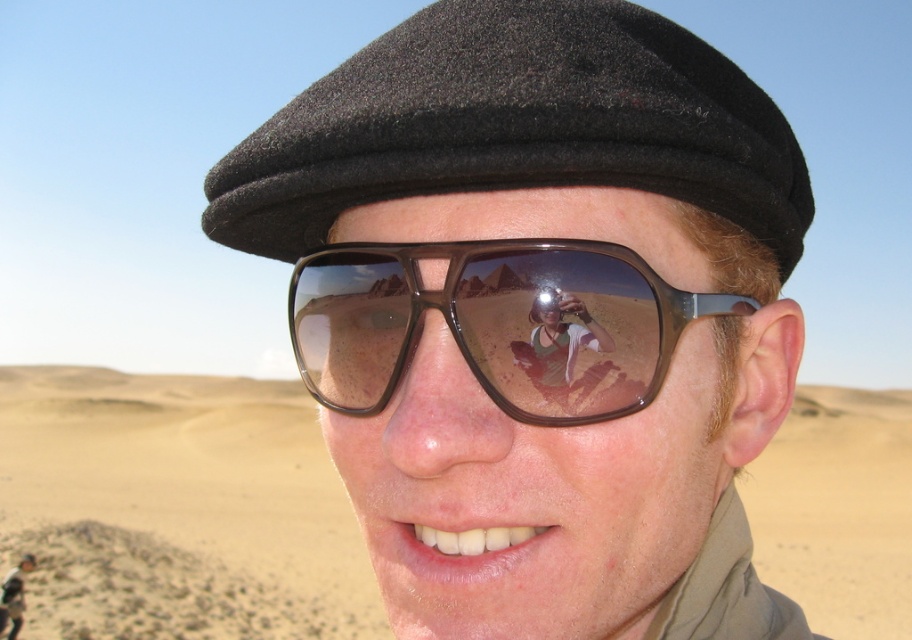
You are a photographer in the desert. You notice two points marked on your camera screen at coordinates point (197, 435) and point (457, 90). If you want to focus on the point that is closer to the foreground, which coordinate should you choose?

Point (457, 90) is closer to the foreground, so you should choose point (457, 90).

You are standing in a desert and see the point marked as point (183,502). Based on the scene description, what is the location of this point relative to the desert sand at lower left?

The point (183,502) is located at the desert sand at lower left.

You are a photographer setting up a shot in the desert. You notice the matte black cap at center and the black woolen cap at upper center in your viewfinder. Which cap is positioned to the right side of the other?

The matte black cap at center is to the right of the black woolen cap at upper center.